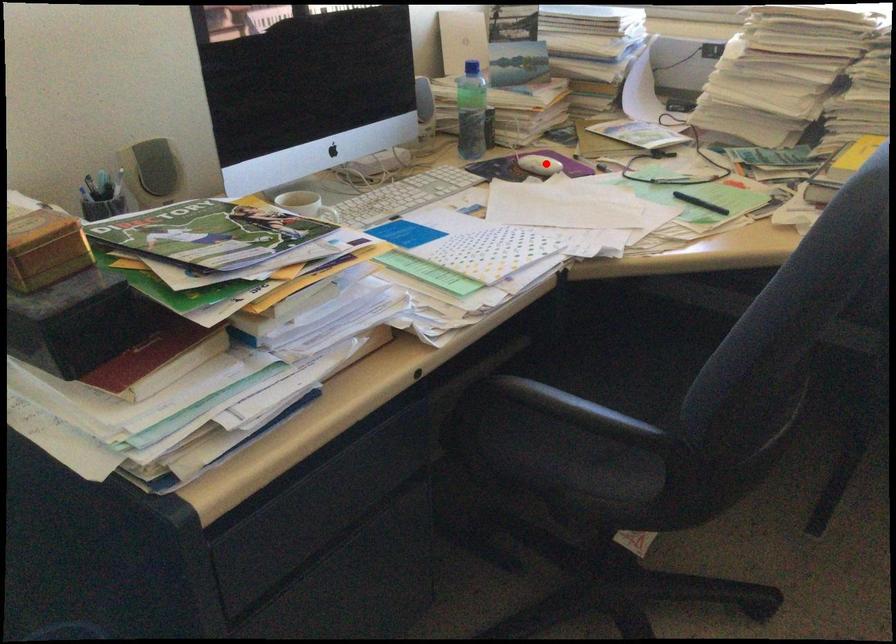
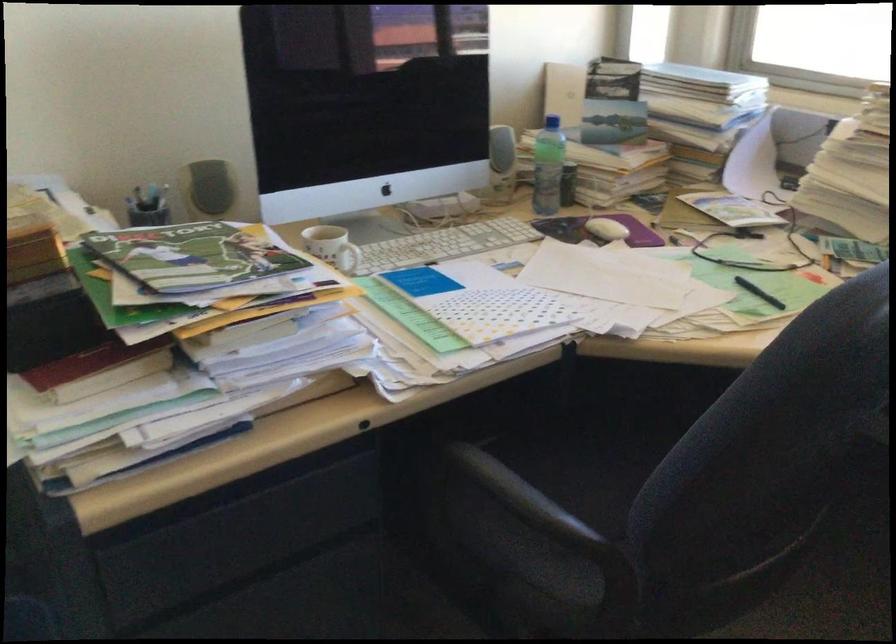
Find the pixel in the second image that matches the highlighted location in the first image.

(606, 229)